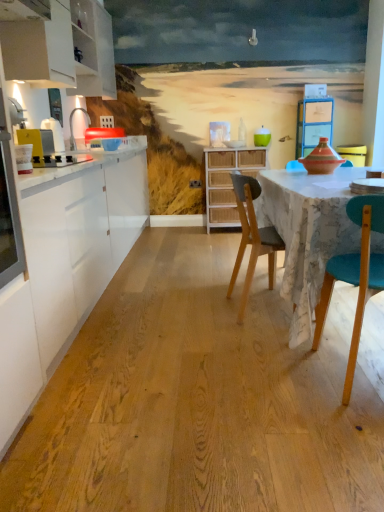
Question: Should I look upward or downward to see white wicker cabinet at center?

Choices:
 (A) down
 (B) up

Answer: (B)

Question: Is white wicker cabinet at center to the left of wooden chair at center from the viewer's perspective?

Choices:
 (A) yes
 (B) no

Answer: (B)

Question: Is wooden chair at center completely or partially inside white wicker cabinet at center?

Choices:
 (A) no
 (B) yes

Answer: (A)

Question: Can you confirm if white wicker cabinet at center is smaller than wooden chair at center?

Choices:
 (A) no
 (B) yes

Answer: (A)

Question: Can you confirm if white wicker cabinet at center is positioned to the right of wooden chair at center?

Choices:
 (A) no
 (B) yes

Answer: (B)

Question: Is white wicker cabinet at center wider than wooden chair at center?

Choices:
 (A) yes
 (B) no

Answer: (B)

Question: Is white wicker cabinet at center looking in the opposite direction of wooden chair at center?

Choices:
 (A) yes
 (B) no

Answer: (B)

Question: From a real-world perspective, is white matte cabinet at upper left physically above wooden chair at center?

Choices:
 (A) yes
 (B) no

Answer: (A)

Question: Does white matte cabinet at upper left have a lesser width compared to wooden chair at center?

Choices:
 (A) yes
 (B) no

Answer: (A)

Question: From the image's perspective, does white matte cabinet at upper left appear lower than wooden chair at center?

Choices:
 (A) no
 (B) yes

Answer: (A)

Question: Is white matte cabinet at upper left far away from wooden chair at center?

Choices:
 (A) yes
 (B) no

Answer: (A)

Question: Is white matte cabinet at upper left to the right of wooden chair at center from the viewer's perspective?

Choices:
 (A) yes
 (B) no

Answer: (B)

Question: Is white matte cabinet at upper left outside wooden chair at center?

Choices:
 (A) no
 (B) yes

Answer: (B)

Question: Could you tell me if white glossy countertop at left is facing teal glossy bowl at upper center?

Choices:
 (A) no
 (B) yes

Answer: (B)